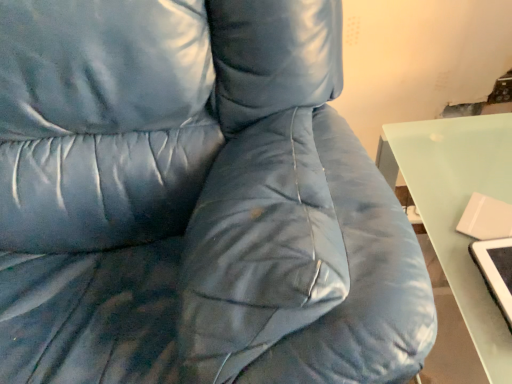
Identify the location of black glossy tablet at right. click(x=496, y=270).

The height and width of the screenshot is (384, 512). What do you see at coordinates (496, 270) in the screenshot?
I see `black glossy tablet at right` at bounding box center [496, 270].

This screenshot has height=384, width=512. I want to click on black glossy tablet at right, so click(496, 270).